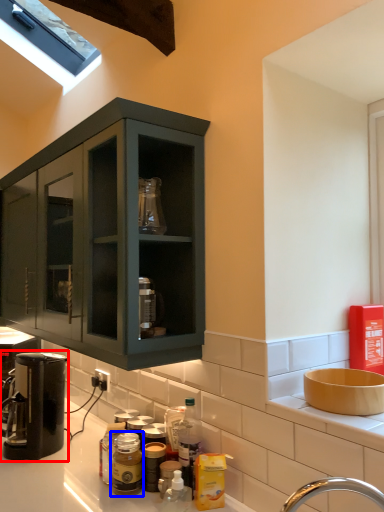
Question: Which point is closer to the camera, coffee machine (highlighted by a red box) or bottle (highlighted by a blue box)?

Choices:
 (A) coffee machine
 (B) bottle

Answer: (B)